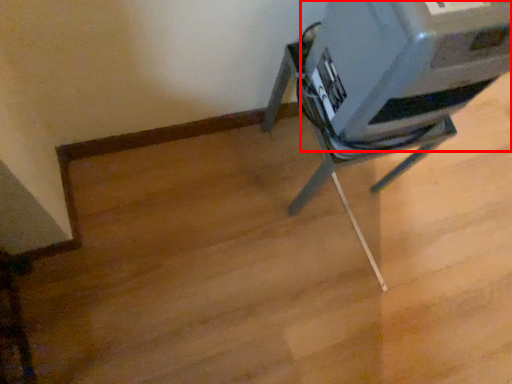
Question: From the image's perspective, where is printer (annotated by the red box) located in relation to furniture in the image?

Choices:
 (A) above
 (B) below

Answer: (A)